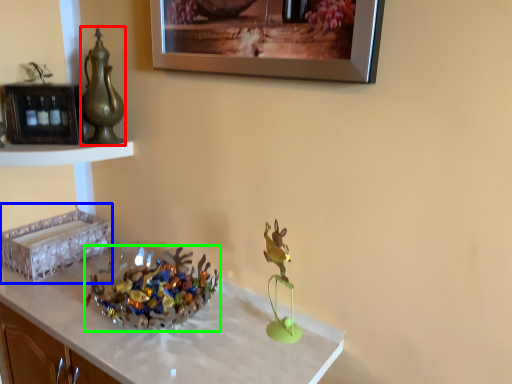
Question: Considering the real-world distances, which object is farthest from tea pot (highlighted by a red box)? shelf (highlighted by a blue box) or floral arrangement (highlighted by a green box)?

Choices:
 (A) shelf
 (B) floral arrangement

Answer: (B)